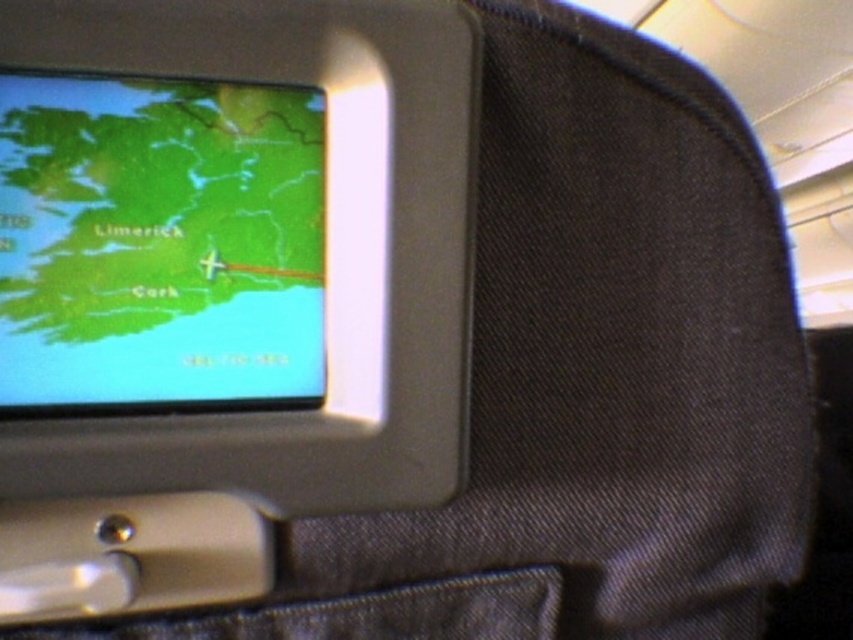
Question: In this image, where is matte plastic screen at upper left located relative to denim at lower left?

Choices:
 (A) above
 (B) below

Answer: (A)

Question: Among these objects, which one is farthest from the camera?

Choices:
 (A) matte plastic screen at upper left
 (B) green matte map at upper left
 (C) denim at lower left

Answer: (C)

Question: Considering the relative positions of matte plastic screen at upper left and denim at lower left in the image provided, where is matte plastic screen at upper left located with respect to denim at lower left?

Choices:
 (A) below
 (B) above

Answer: (B)

Question: Is green matte map at upper left below denim at lower left?

Choices:
 (A) no
 (B) yes

Answer: (A)

Question: Which of the following is the closest to the observer?

Choices:
 (A) (149, 636)
 (B) (105, 257)

Answer: (B)

Question: Which object is positioned closest to the green matte map at upper left?

Choices:
 (A) denim at lower left
 (B) matte plastic screen at upper left

Answer: (B)